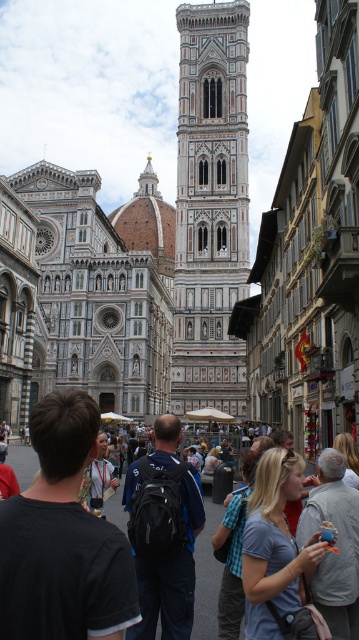
You are a tourist in Florence, standing in front of the Florence Cathedral. You see a matte gray backpack at lower right and a matte black backpack at center. Which backpack is smaller?

The matte gray backpack at lower right is smaller than the matte black backpack at center.

You are standing in front of the Florence Cathedral and want to take a photo of the white marble cathedral at center. If your camera can focus on objects up to 80 meters away, will it be able to capture the cathedral clearly?

The white marble cathedral at center is 77.41 meters away from viewer, which is within the camera focus range of up to 80 meters. Therefore, the camera can capture the cathedral clearly.

You are a tourist standing in front of the Florence Cathedral. You have a black fabric backpack at center and see the white marble cathedral at center. Which object is bigger in size?

The white marble cathedral at center is larger in size than the black fabric backpack at center.